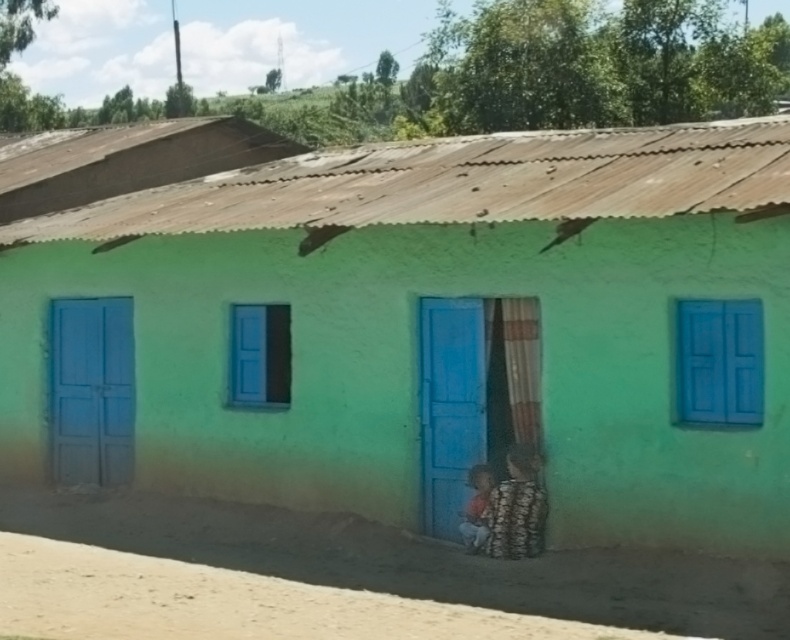
Which of these two, green matte house at center or matte blue door at left, stands shorter?

With less height is green matte house at center.

Can you confirm if green matte house at center is thinner than matte blue door at left?

Correct, green matte house at center's width is less than matte blue door at left's.

Image resolution: width=790 pixels, height=640 pixels. Identify the location of green matte house at center. (418, 323).

Identify the location of green matte house at center. point(418,323).

Where is `matte blue door at left`? matte blue door at left is located at coordinates (92, 390).

Measure the distance between matte blue door at left and blue matte door at center.

matte blue door at left is 3.67 meters from blue matte door at center.

Find the location of a particular element. matte blue door at left is located at coordinates (92, 390).

Can you confirm if green matte house at center is shorter than blue matte door at center?

Indeed, green matte house at center has a lesser height compared to blue matte door at center.

The width and height of the screenshot is (790, 640). What do you see at coordinates (418, 323) in the screenshot?
I see `green matte house at center` at bounding box center [418, 323].

Does point (399, 451) lie behind point (450, 314)?

Yes, it is.

Locate an element on the screen. This screenshot has height=640, width=790. green matte house at center is located at coordinates (418, 323).